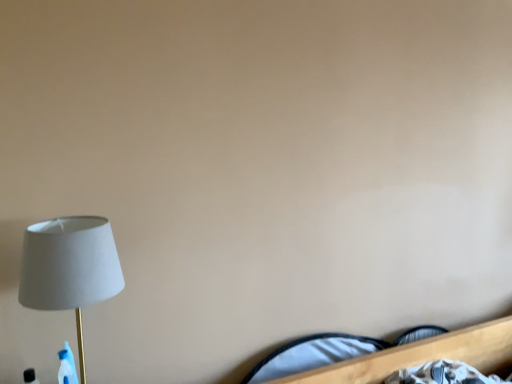
Question: Is white fabric bed at lower right inside the boundaries of white fabric lamp at left, or outside?

Choices:
 (A) outside
 (B) inside

Answer: (A)

Question: From a real-world perspective, is white fabric bed at lower right above or below white fabric lamp at left?

Choices:
 (A) above
 (B) below

Answer: (B)

Question: Considering the relative positions of white fabric bed at lower right and white fabric lamp at left in the image provided, is white fabric bed at lower right to the left or to the right of white fabric lamp at left?

Choices:
 (A) left
 (B) right

Answer: (B)

Question: Considering the positions of white fabric lamp at left and white fabric bed at lower right in the image, is white fabric lamp at left taller or shorter than white fabric bed at lower right?

Choices:
 (A) tall
 (B) short

Answer: (A)

Question: Is point (119, 276) positioned closer to the camera than point (505, 327)?

Choices:
 (A) farther
 (B) closer

Answer: (B)

Question: From the image's perspective, is white fabric lamp at left positioned above or below white fabric bed at lower right?

Choices:
 (A) below
 (B) above

Answer: (B)

Question: Based on their positions, is white fabric lamp at left located to the left or right of white fabric bed at lower right?

Choices:
 (A) right
 (B) left

Answer: (B)